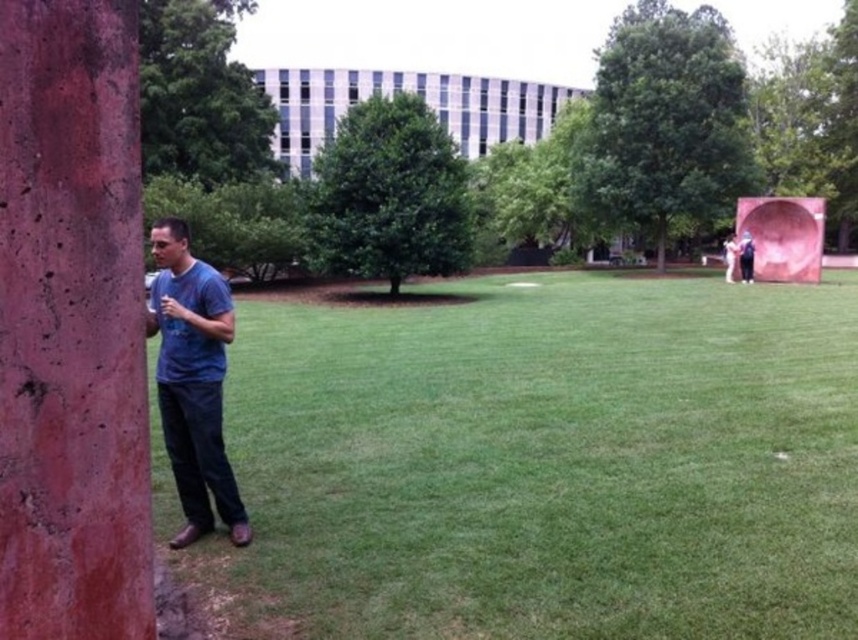
Question: Is the position of green leafy tree at upper right less distant than that of matte blue shirt at right?

Choices:
 (A) yes
 (B) no

Answer: (B)

Question: Where is green leafy tree at upper left located in relation to matte blue shirt at right in the image?

Choices:
 (A) below
 (B) above

Answer: (B)

Question: Which object is positioned closest to the green leafy tree at upper right?

Choices:
 (A) white matte statue at upper right
 (B) rusty metal pole at left
 (C) green grass at lower center
 (D) matte blue shirt at right

Answer: (A)

Question: Among these points, which one is nearest to the camera?

Choices:
 (A) (520, 522)
 (B) (739, 131)
 (C) (240, 544)
 (D) (37, 406)

Answer: (D)

Question: Does green grass at lower center appear over rusty metal pole at left?

Choices:
 (A) yes
 (B) no

Answer: (B)

Question: Which of these objects is positioned closest to the matte blue shirt at right?

Choices:
 (A) green grass at lower center
 (B) green leafy tree at upper right
 (C) green leafy tree at center
 (D) blue t-shirt at left

Answer: (B)